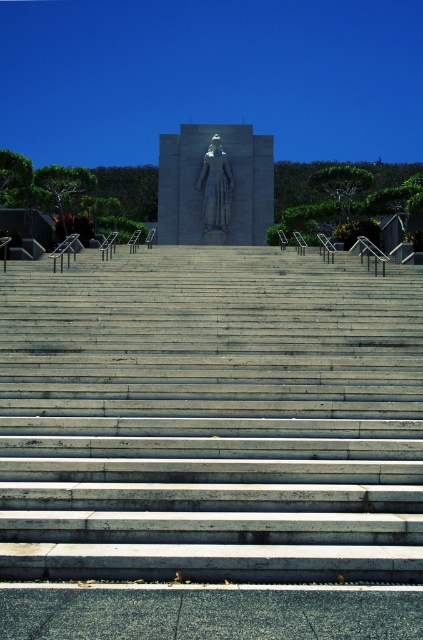
You are a tour guide explaining the monument to visitors. You mention both the gray concrete stairs at center and the polished stone statue at center. Which one is bigger in size?

The gray concrete stairs at center has a larger size compared to the polished stone statue at center.

You are standing at the bottom of the gray concrete stairs at center and want to reach the polished stone statue at center. Which direction should you move to get closer to the statue?

You should move upwards along the gray concrete stairs at center to get closer to the polished stone statue at center since the stairs lead directly towards the statue.

You are standing at the bottom of the gray concrete stairs at center and want to reach the polished stone statue at center. In which direction should you move relative to the stairs to reach the statue?

You should move to the left relative to the gray concrete stairs at center because the polished stone statue at center is to the left of the stairs according to the description.